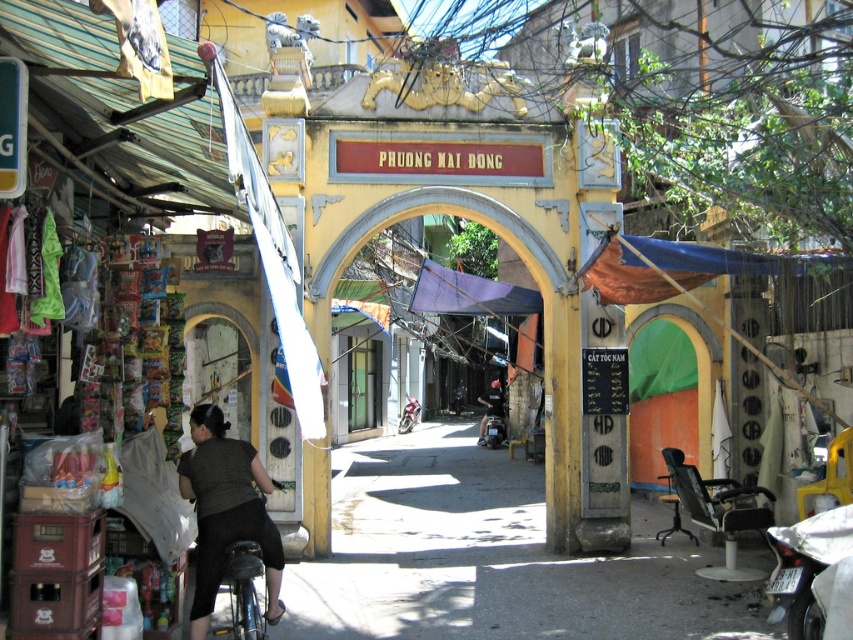
Question: Is knitted sweater at lower left below shiny silver motorcycle at center?

Choices:
 (A) no
 (B) yes

Answer: (A)

Question: Which object is the farthest from the shiny silver motorcycle at center?

Choices:
 (A) knitted sweater at lower left
 (B) dark gray fabric jacket at center

Answer: (A)

Question: Among these objects, which one is farthest from the camera?

Choices:
 (A) dark gray fabric jacket at center
 (B) shiny silver motorcycle at center
 (C) knitted sweater at lower left

Answer: (B)

Question: Which point is farther to the camera?

Choices:
 (A) knitted sweater at lower left
 (B) dark gray fabric jacket at center

Answer: (B)

Question: Where is dark gray fabric jacket at center located in relation to shiny silver motorcycle at center in the image?

Choices:
 (A) left
 (B) right

Answer: (B)

Question: Is knitted sweater at lower left positioned behind dark gray fabric jacket at center?

Choices:
 (A) yes
 (B) no

Answer: (B)